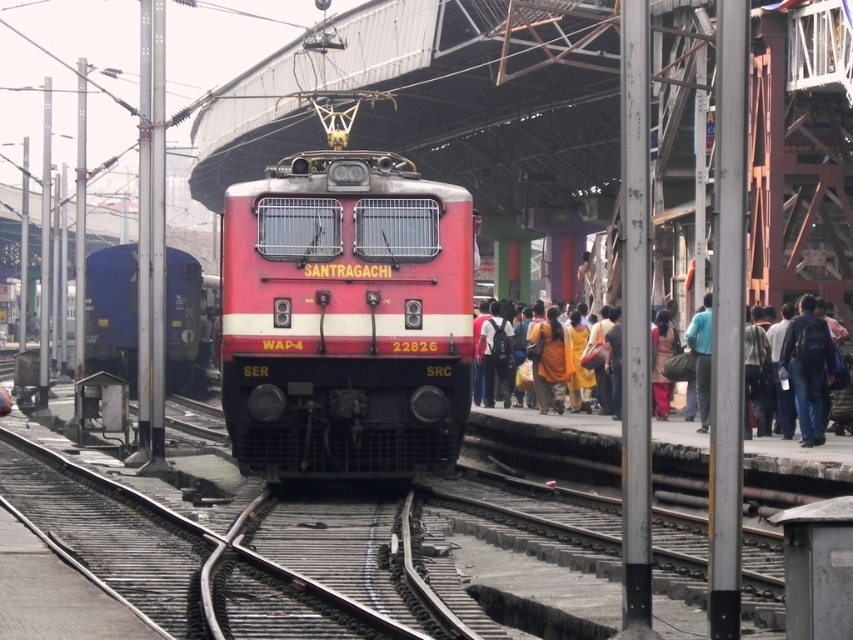
Question: Which point is farther to the camera?

Choices:
 (A) blue matte freight car at left
 (B) denim jeans at right

Answer: (A)

Question: Which point is farther from the camera taking this photo?

Choices:
 (A) (833, 353)
 (B) (122, 253)

Answer: (B)

Question: Which point appears farthest from the camera in this image?

Choices:
 (A) (300, 264)
 (B) (91, 369)

Answer: (B)

Question: Is yellow cotton dress at right above denim jeans at right?

Choices:
 (A) no
 (B) yes

Answer: (A)

Question: Does matte red train at center appear on the left side of yellow cotton dress at right?

Choices:
 (A) yes
 (B) no

Answer: (A)

Question: Is matte red train at center smaller than yellow cotton dress at right?

Choices:
 (A) yes
 (B) no

Answer: (A)